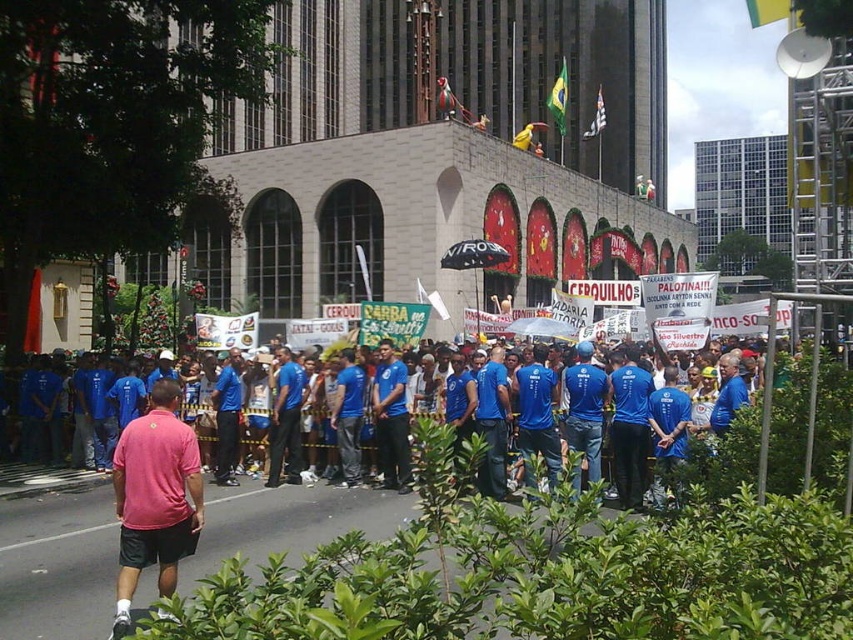
Is pink cotton polo shirt at center to the right of blue fabric shirt at center from the viewer's perspective?

No, pink cotton polo shirt at center is not to the right of blue fabric shirt at center.

Does point (131, 424) lie in front of point (399, 403)?

Yes, point (131, 424) is closer to viewer.

You are a GUI agent. You are given a task and a screenshot of the screen. Output one action in this format:
    pyautogui.click(x=<x>, y=<y>)
    Task: Click on the pink cotton polo shirt at center
    The width and height of the screenshot is (853, 640).
    Given the screenshot: What is the action you would take?
    pyautogui.click(x=155, y=497)